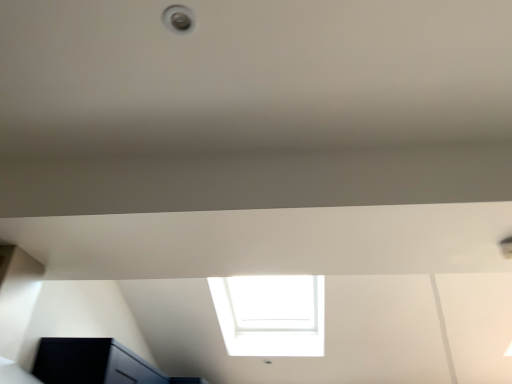
Consider the image. In order to face matte silver droplight at upper center, should I rotate leftwards or rightwards?

Rotate your view left by about 10.187°.

This screenshot has width=512, height=384. Describe the element at coordinates (178, 19) in the screenshot. I see `matte silver droplight at upper center` at that location.

Identify the location of matte silver droplight at upper center. (178, 19).

Image resolution: width=512 pixels, height=384 pixels. I want to click on matte silver droplight at upper center, so click(x=178, y=19).